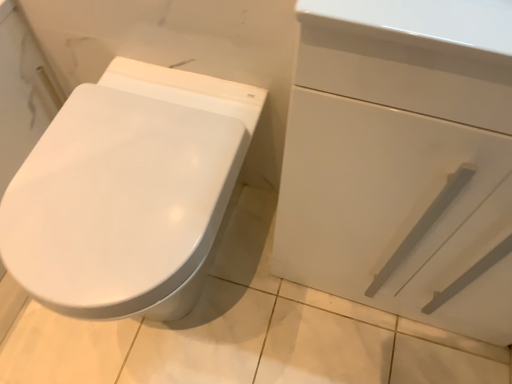
Question: From a real-world perspective, is white glossy drawer at right over white glossy bidet at left?

Choices:
 (A) no
 (B) yes

Answer: (B)

Question: Is white glossy drawer at right outside of white glossy bidet at left?

Choices:
 (A) yes
 (B) no

Answer: (A)

Question: Is white glossy drawer at right to the right of white glossy bidet at left from the viewer's perspective?

Choices:
 (A) yes
 (B) no

Answer: (A)

Question: Is white glossy drawer at right behind white glossy bidet at left?

Choices:
 (A) yes
 (B) no

Answer: (B)

Question: From the image's perspective, is white glossy drawer at right located above white glossy bidet at left?

Choices:
 (A) yes
 (B) no

Answer: (A)

Question: From a real-world perspective, does white glossy drawer at right sit lower than white glossy bidet at left?

Choices:
 (A) no
 (B) yes

Answer: (A)

Question: Would you say white glossy bidet at left is a long distance from white glossy drawer at right?

Choices:
 (A) no
 (B) yes

Answer: (A)

Question: Is white glossy bidet at left oriented towards white glossy drawer at right?

Choices:
 (A) no
 (B) yes

Answer: (A)

Question: Does white glossy bidet at left have a lesser height compared to white glossy drawer at right?

Choices:
 (A) no
 (B) yes

Answer: (B)

Question: Can you confirm if white glossy bidet at left is wider than white glossy drawer at right?

Choices:
 (A) no
 (B) yes

Answer: (B)

Question: From the image's perspective, is white glossy bidet at left over white glossy drawer at right?

Choices:
 (A) no
 (B) yes

Answer: (A)

Question: Considering the relative sizes of white glossy bidet at left and white glossy drawer at right in the image provided, is white glossy bidet at left bigger than white glossy drawer at right?

Choices:
 (A) no
 (B) yes

Answer: (A)

Question: Considering the positions of white glossy bidet at left and white glossy drawer at right in the image, is white glossy bidet at left taller or shorter than white glossy drawer at right?

Choices:
 (A) short
 (B) tall

Answer: (A)